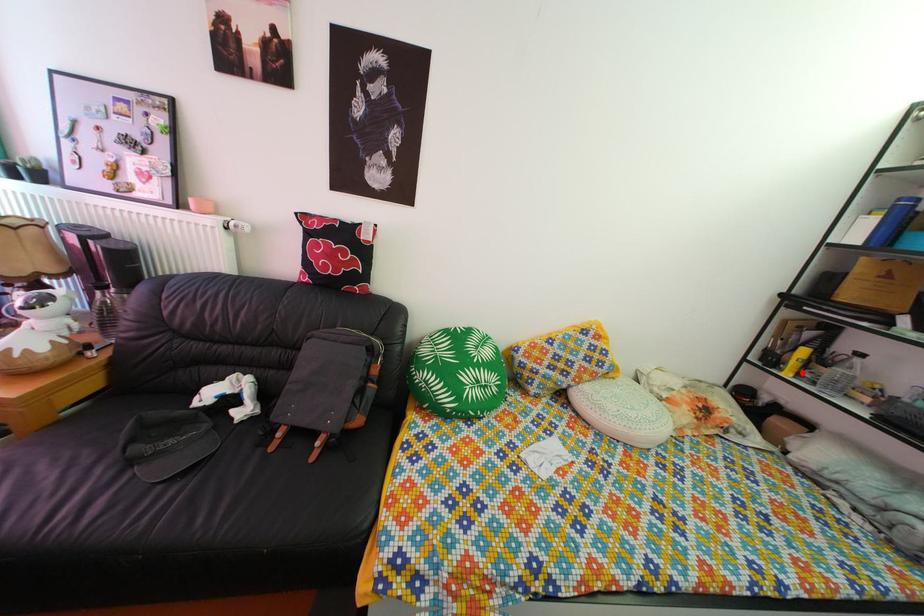
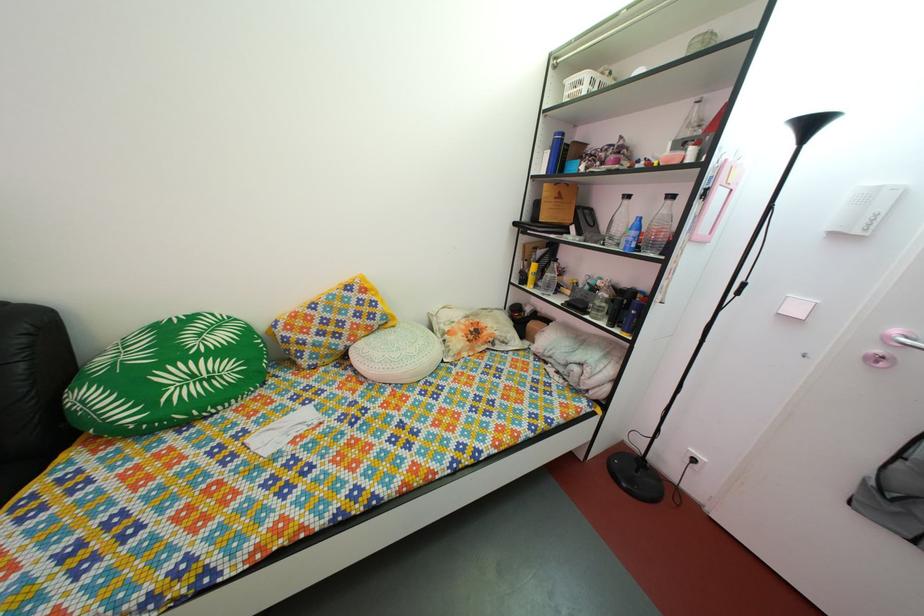
Question: A red point is marked in image1. In image2, is the corresponding 3D point closer to the camera or farther? Reply with the corresponding letter.

Choices:
 (A) The corresponding 3D point is closer.
 (B) The corresponding 3D point is farther.

Answer: (A)